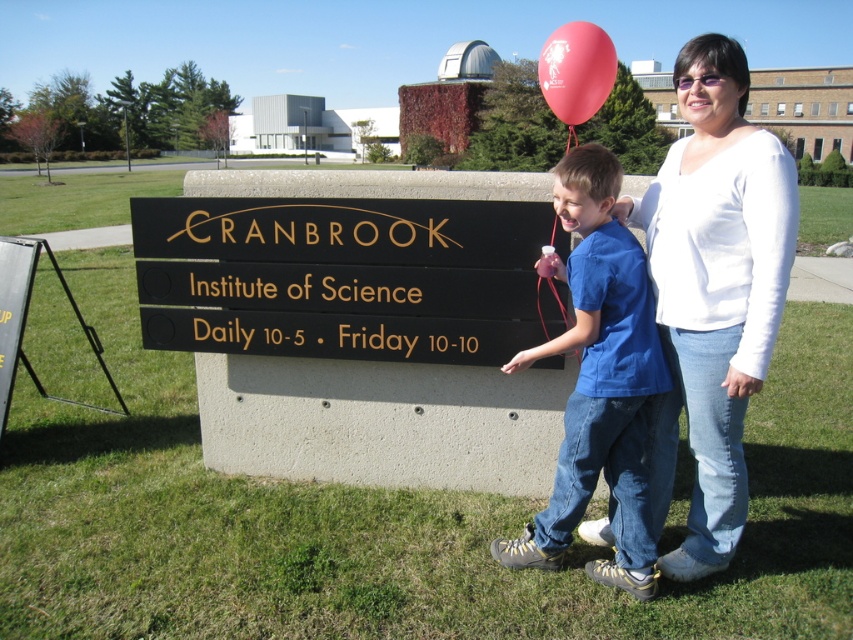
Can you confirm if black polished wood sign at center is bigger than rubber balloon at upper center?

Incorrect, black polished wood sign at center is not larger than rubber balloon at upper center.

Who is positioned more to the left, black polished wood sign at center or rubber balloon at upper center?

Positioned to the left is black polished wood sign at center.

At what (x,y) coordinates should I click in order to perform the action: click on black polished wood sign at center. Please return your answer as a coordinate pair (x, y). The width and height of the screenshot is (853, 640). Looking at the image, I should click on (343, 276).

This screenshot has width=853, height=640. Find the location of `black polished wood sign at center`. black polished wood sign at center is located at coordinates (343, 276).

Based on the photo, is white smooth shirt at upper right to the left of blue cotton shirt at center from the viewer's perspective?

In fact, white smooth shirt at upper right is to the right of blue cotton shirt at center.

Which is in front, point (733, 282) or point (585, 428)?

Positioned in front is point (733, 282).

Identify the location of white smooth shirt at upper right. (712, 291).

This screenshot has height=640, width=853. Find the location of `black polished wood sign at center`. black polished wood sign at center is located at coordinates (343, 276).

This screenshot has width=853, height=640. What are the coordinates of `black polished wood sign at center` in the screenshot? It's located at (343, 276).